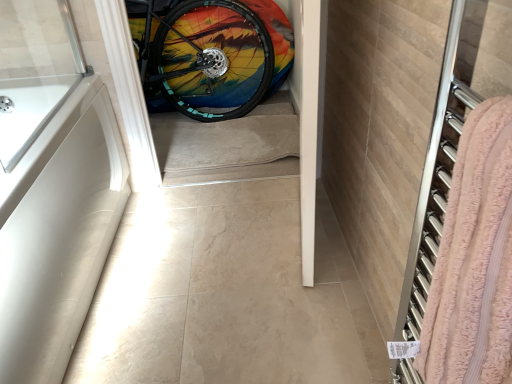
Question: Is white matte bathtub at left oriented towards rainbow painted tire at center?

Choices:
 (A) yes
 (B) no

Answer: (B)

Question: Considering the relative sizes of white matte bathtub at left and rainbow painted tire at center in the image provided, is white matte bathtub at left shorter than rainbow painted tire at center?

Choices:
 (A) no
 (B) yes

Answer: (B)

Question: From the image's perspective, is white matte bathtub at left located above rainbow painted tire at center?

Choices:
 (A) yes
 (B) no

Answer: (B)

Question: Is white matte bathtub at left positioned far away from rainbow painted tire at center?

Choices:
 (A) yes
 (B) no

Answer: (A)

Question: Would you say white matte bathtub at left contains rainbow painted tire at center?

Choices:
 (A) yes
 (B) no

Answer: (B)

Question: Considering the relative positions of white matte bathtub at left and rainbow painted tire at center in the image provided, is white matte bathtub at left to the left of rainbow painted tire at center from the viewer's perspective?

Choices:
 (A) yes
 (B) no

Answer: (A)

Question: Can you confirm if white matte bathtub at left is wider than pink terry cloth towel at right?

Choices:
 (A) yes
 (B) no

Answer: (A)

Question: Is white matte bathtub at left bigger than pink terry cloth towel at right?

Choices:
 (A) no
 (B) yes

Answer: (B)

Question: From a real-world perspective, is white matte bathtub at left positioned under pink terry cloth towel at right based on gravity?

Choices:
 (A) no
 (B) yes

Answer: (B)

Question: Does white matte bathtub at left have a lesser width compared to pink terry cloth towel at right?

Choices:
 (A) yes
 (B) no

Answer: (B)

Question: Is white matte bathtub at left aimed at pink terry cloth towel at right?

Choices:
 (A) yes
 (B) no

Answer: (A)

Question: Is white matte bathtub at left surrounding pink terry cloth towel at right?

Choices:
 (A) no
 (B) yes

Answer: (A)

Question: Is rainbow painted tire at center behind white matte bathtub at left?

Choices:
 (A) yes
 (B) no

Answer: (A)